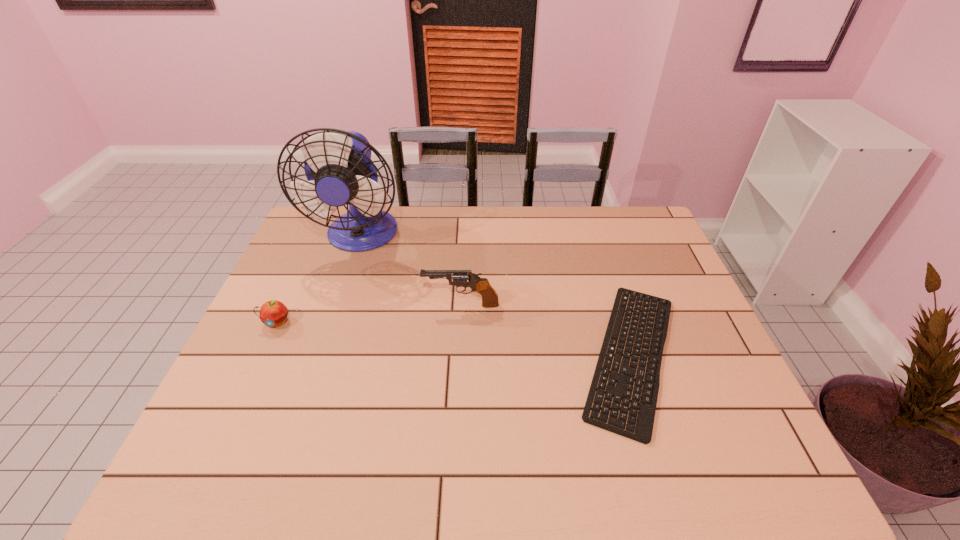
Identify the location of blank space located along the barrel of the second object from right to left. (344, 305).

Identify the location of vacant space situated on the front of the second shortest object. Image resolution: width=960 pixels, height=540 pixels. (239, 404).

Find the location of a particular element. The height and width of the screenshot is (540, 960). vacant space positioned on the left of the shortest object is located at coordinates (468, 355).

Locate an element on the screen. This screenshot has width=960, height=540. object that is at the far edge is located at coordinates (338, 166).

Where is `object at the near edge`? This screenshot has width=960, height=540. object at the near edge is located at coordinates (644, 427).

Find the location of `fan located at the left edge`. fan located at the left edge is located at coordinates tap(338, 166).

You are a GUI agent. You are given a task and a screenshot of the screen. Output one action in this format:
    pyautogui.click(x=<x>, y=<y>)
    Task: Click on the apple at the left edge
    This screenshot has height=540, width=960.
    Given the screenshot: What is the action you would take?
    pyautogui.click(x=273, y=313)

Locate an element on the screen. object present at the right edge is located at coordinates (644, 427).

Where is `object at the far left corner`? This screenshot has width=960, height=540. object at the far left corner is located at coordinates (338, 166).

This screenshot has width=960, height=540. I want to click on object that is at the near right corner, so click(x=644, y=427).